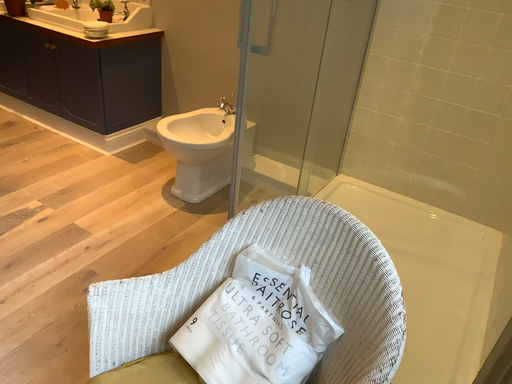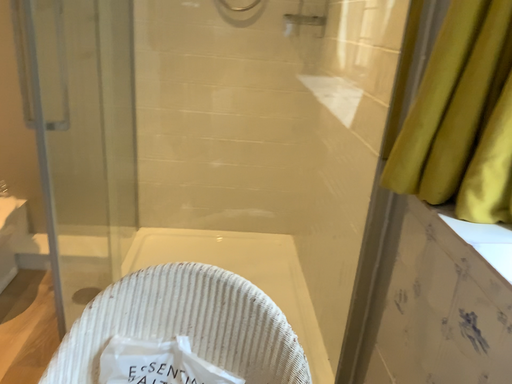
Question: How did the camera likely rotate when shooting the video?

Choices:
 (A) rotated left
 (B) rotated right

Answer: (B)